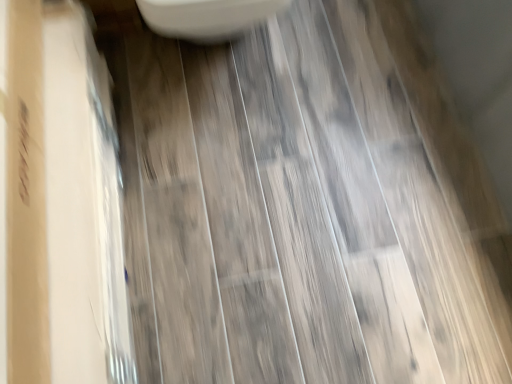
In order to face matte white cardboard box at left, should I rotate leftwards or rightwards?

Rotate your view left by about 24.047°.

What do you see at coordinates (59, 203) in the screenshot?
I see `matte white cardboard box at left` at bounding box center [59, 203].

I want to click on matte white cardboard box at left, so click(x=59, y=203).

Image resolution: width=512 pixels, height=384 pixels. Identify the location of matte white cardboard box at left. (59, 203).